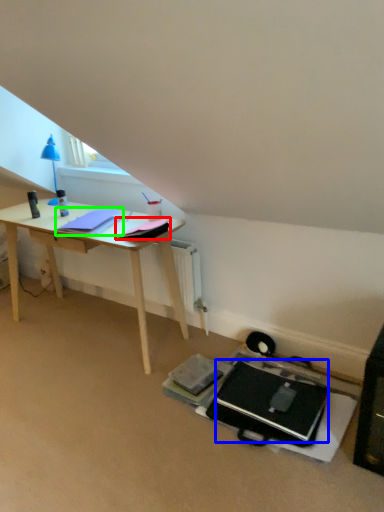
Question: Estimate the real-world distances between objects in this image. Which object is closer to notepad (highlighted by a red box), laptop (highlighted by a blue box) or notepad (highlighted by a green box)?

Choices:
 (A) laptop
 (B) notepad

Answer: (B)